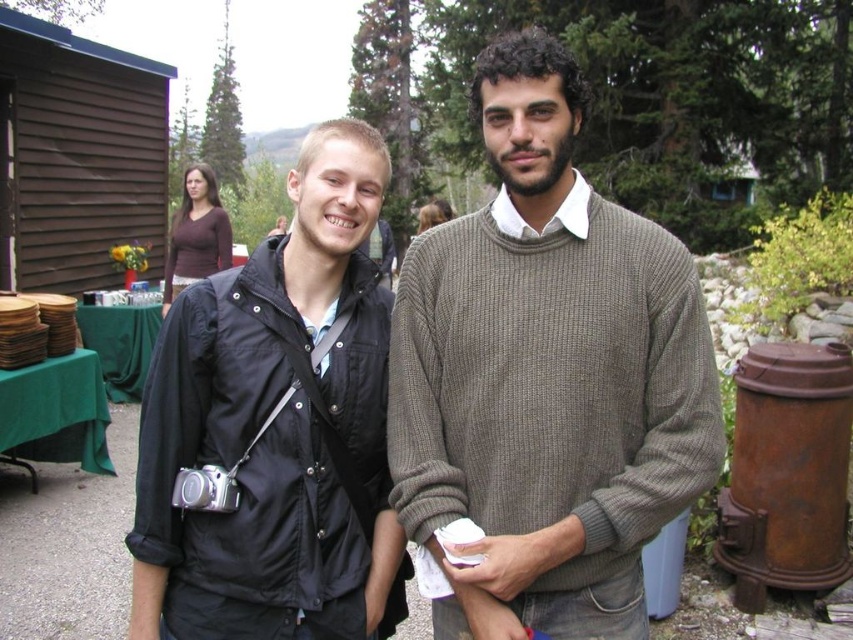
Does black matte jacket at left have a greater width compared to brown matte shirt at upper left?

Indeed, black matte jacket at left has a greater width compared to brown matte shirt at upper left.

Which is more to the left, black matte jacket at left or brown matte shirt at upper left?

brown matte shirt at upper left is more to the left.

I want to click on black matte jacket at left, so coord(276,426).

Locate an element on the screen. The image size is (853, 640). black matte jacket at left is located at coordinates (276, 426).

Can you confirm if knit brown sweater at center is wider than black matte jacket at left?

Yes, knit brown sweater at center is wider than black matte jacket at left.

Is knit brown sweater at center smaller than black matte jacket at left?

No, knit brown sweater at center is not smaller than black matte jacket at left.

Image resolution: width=853 pixels, height=640 pixels. What are the coordinates of `knit brown sweater at center` in the screenshot? It's located at (546, 376).

At what (x,y) coordinates should I click in order to perform the action: click on knit brown sweater at center. Please return your answer as a coordinate pair (x, y). Looking at the image, I should click on (546, 376).

Is knit brown sweater at center wider than brown matte shirt at upper left?

Indeed, knit brown sweater at center has a greater width compared to brown matte shirt at upper left.

Looking at this image, who is more distant from viewer, (705, 337) or (173, 289)?

Positioned behind is point (173, 289).

Identify the location of knit brown sweater at center. This screenshot has height=640, width=853. (546, 376).